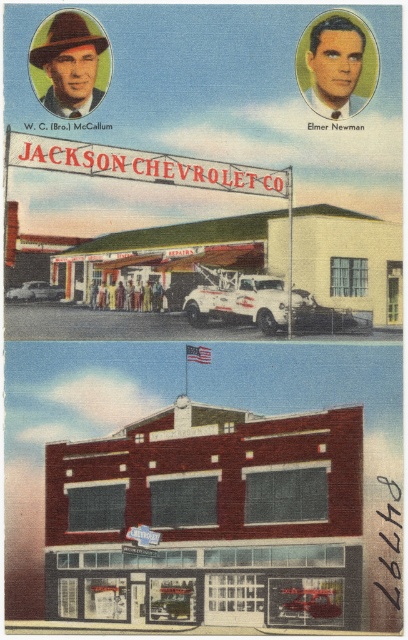
You are a customer standing in the street in front of Jackson Chevrolet Co. You see the brick building at center and the matte brown hat at upper left. Which object is closer to the left side of the image?

The matte brown hat at upper left is closer to the left side of the image because it is positioned to the left of the brick building at center.